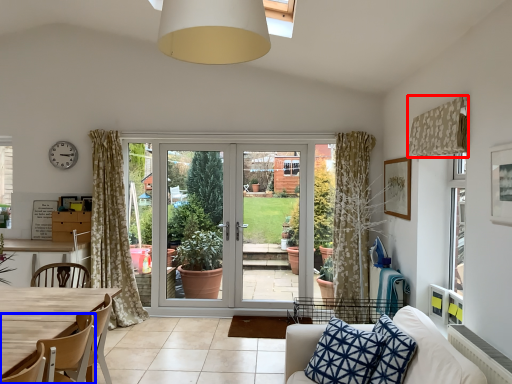
Question: Which object appears farthest to the camera in this image, curtain (highlighted by a red box) or chair (highlighted by a blue box)?

Choices:
 (A) curtain
 (B) chair

Answer: (A)